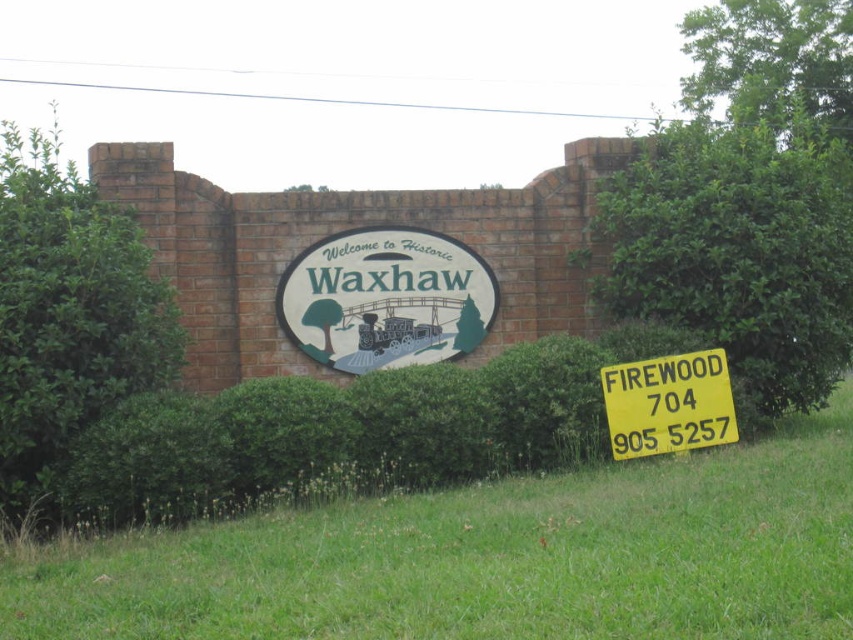
You are a tourist standing in front of the brick wall with the Welcome sign. You notice a green leafy bush at right and a white painted wood sign at center. Which object would block your view more if you were to stand directly in front of the brick wall?

The green leafy bush at right is larger in size than the white painted wood sign at center, so it would block your view more.

Consider the image. You are standing in front of the brick wall with the two signs. You notice two points marked on the wall. Which point, point (210, 612) or point (807, 360), is closer to you?

Point (210, 612) is closer to the viewer than point (807, 360).